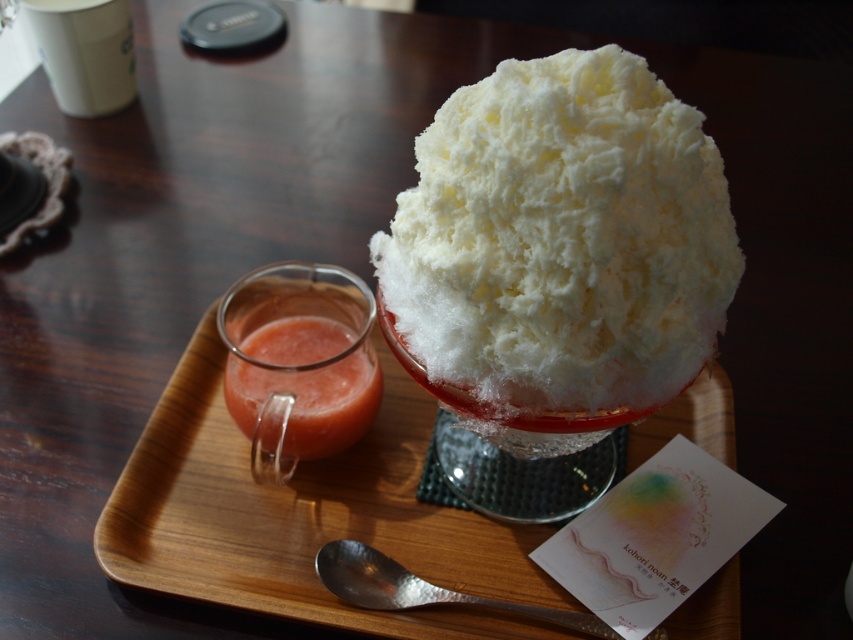
In the scene shown: How distant is white fluffy shaved ice at center from white matte cup at upper left?

19.81 inches

Does white fluffy shaved ice at center lie behind white matte cup at upper left?

No, it is in front of white matte cup at upper left.

Does point (451, 346) come in front of point (129, 10)?

That is True.

Where is `white fluffy shaved ice at center`? The width and height of the screenshot is (853, 640). white fluffy shaved ice at center is located at coordinates (561, 240).

What do you see at coordinates (561, 240) in the screenshot? I see `white fluffy shaved ice at center` at bounding box center [561, 240].

Who is shorter, white fluffy shaved ice at center or translucent glass juice at upper left?

With less height is translucent glass juice at upper left.

Which is in front, point (492, 244) or point (247, 349)?

Point (492, 244) is in front.

Locate an element on the screen. The height and width of the screenshot is (640, 853). white fluffy shaved ice at center is located at coordinates (561, 240).

The width and height of the screenshot is (853, 640). What do you see at coordinates (561, 240) in the screenshot? I see `white fluffy shaved ice at center` at bounding box center [561, 240].

Which is more to the right, white fluffy shaved ice at center or silver hammered spoon at lower center?

white fluffy shaved ice at center is more to the right.

This screenshot has height=640, width=853. Identify the location of white fluffy shaved ice at center. (561, 240).

At what (x,y) coordinates should I click in order to perform the action: click on white fluffy shaved ice at center. Please return your answer as a coordinate pair (x, y). The height and width of the screenshot is (640, 853). Looking at the image, I should click on (561, 240).